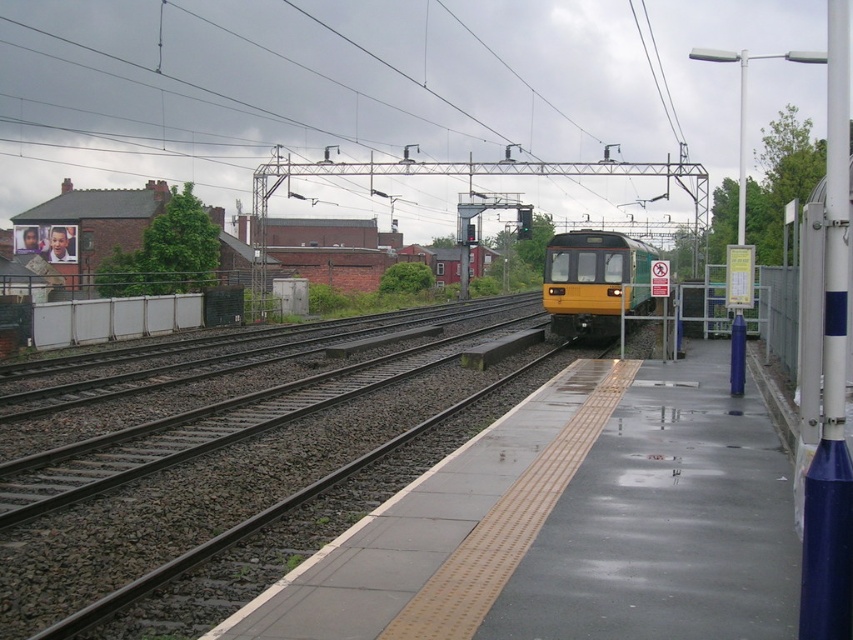
Can you confirm if smooth concrete platform at center is positioned to the left of yellow matte train at center?

Yes, smooth concrete platform at center is to the left of yellow matte train at center.

Is point (572, 605) closer to camera compared to point (628, 308)?

Yes.

Where is `smooth concrete platform at center`? smooth concrete platform at center is located at coordinates (570, 525).